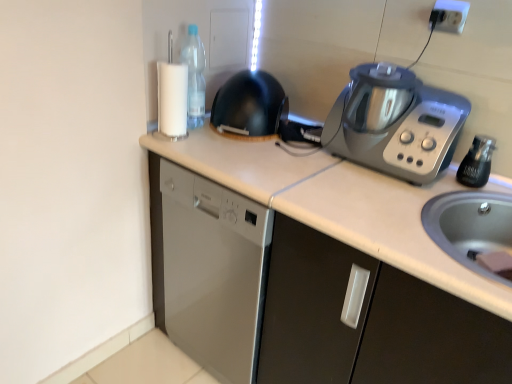
The image size is (512, 384). What do you see at coordinates (449, 16) in the screenshot?
I see `white plastic electric outlet at upper right` at bounding box center [449, 16].

Find the location of `black glass bottle at right, the 2th bottle when ordered from back to front`. black glass bottle at right, the 2th bottle when ordered from back to front is located at coordinates (477, 162).

Could you tell me if transparent plastic bottle at upper left, arranged as the second bottle when viewed from the front, is turned towards white plastic electric outlet at upper right?

No, transparent plastic bottle at upper left, arranged as the second bottle when viewed from the front, is not turned towards white plastic electric outlet at upper right.

From a real-world perspective, is transparent plastic bottle at upper left, which is the 1th bottle from top to bottom, physically below white plastic electric outlet at upper right?

Indeed, from a real-world perspective, transparent plastic bottle at upper left, which is the 1th bottle from top to bottom, is positioned beneath white plastic electric outlet at upper right.

Can you tell me how much transparent plastic bottle at upper left, which is the 1th bottle from top to bottom, and white plastic electric outlet at upper right differ in facing direction?

The angle between the facing direction of transparent plastic bottle at upper left, which is the 1th bottle from top to bottom, and the facing direction of white plastic electric outlet at upper right is 0.00301 degrees.

Between silver metallic kitchen appliance at upper right and transparent plastic bottle at upper left, which appears as the 1th bottle when viewed from the left, which one has smaller width?

With smaller width is transparent plastic bottle at upper left, which appears as the 1th bottle when viewed from the left.

From the picture: Is silver metallic kitchen appliance at upper right shorter than transparent plastic bottle at upper left, arranged as the second bottle when viewed from the front?

Correct, silver metallic kitchen appliance at upper right is not as tall as transparent plastic bottle at upper left, arranged as the second bottle when viewed from the front.

How many degrees apart are the facing directions of silver metallic kitchen appliance at upper right and transparent plastic bottle at upper left, arranged as the second bottle when viewed from the front?

silver metallic kitchen appliance at upper right and transparent plastic bottle at upper left, arranged as the second bottle when viewed from the front, are facing 0.000344 degrees away from each other.

Considering the relative sizes of black matte wok at center and black glass bottle at right, positioned as the 1th bottle in right-to-left order, in the image provided, is black matte wok at center shorter than black glass bottle at right, positioned as the 1th bottle in right-to-left order,?

Incorrect, the height of black matte wok at center does not fall short of that of black glass bottle at right, positioned as the 1th bottle in right-to-left order.

Looking at this image, which point is more forward, (270,132) or (492,138)?

The point (492,138) is more forward.

In terms of size, does black matte wok at center appear bigger or smaller than black glass bottle at right, which is the 1th bottle from bottom to top?

Considering their sizes, black matte wok at center takes up more space than black glass bottle at right, which is the 1th bottle from bottom to top.

From the image's perspective, is black matte wok at center located beneath black glass bottle at right, placed as the 2th bottle when sorted from top to bottom?

Actually, black matte wok at center appears above black glass bottle at right, placed as the 2th bottle when sorted from top to bottom, in the image.

Is silver metallic kitchen appliance at upper right located outside white matte countertop at center?

silver metallic kitchen appliance at upper right lies outside white matte countertop at center's area.

You are a GUI agent. You are given a task and a screenshot of the screen. Output one action in this format:
    pyautogui.click(x=<x>, y=<y>)
    Task: Click on the home appliance located above the white matte countertop at center (from the image's perspective)
    
    Given the screenshot: What is the action you would take?
    pyautogui.click(x=395, y=123)

Which object is further away from the camera, silver metallic kitchen appliance at upper right or white matte countertop at center?

silver metallic kitchen appliance at upper right is behind.

Which is nearer, (399, 126) or (383, 179)?

Point (399, 126)

Does black glass bottle at right, which is counted as the 2th bottle, starting from the left, come behind silver metallic kitchen appliance at upper right?

Yes, black glass bottle at right, which is counted as the 2th bottle, starting from the left, is further from the camera.

Considering the sizes of objects black glass bottle at right, positioned as the 1th bottle in right-to-left order, and silver metallic kitchen appliance at upper right in the image provided, who is taller, black glass bottle at right, positioned as the 1th bottle in right-to-left order, or silver metallic kitchen appliance at upper right?

silver metallic kitchen appliance at upper right.

Can you confirm if black glass bottle at right, placed as the 2th bottle when sorted from top to bottom, is wider than silver metallic kitchen appliance at upper right?

Incorrect, the width of black glass bottle at right, placed as the 2th bottle when sorted from top to bottom, does not surpass that of silver metallic kitchen appliance at upper right.

From a real-world perspective, is black glass bottle at right, which is counted as the 2th bottle, starting from the left, on silver metallic kitchen appliance at upper right?

Incorrect, from a real-world perspective, black glass bottle at right, which is counted as the 2th bottle, starting from the left, is lower than silver metallic kitchen appliance at upper right.

Consider the image. Considering the sizes of white matte countertop at center and black glass bottle at right, the 2th bottle when ordered from back to front, in the image, is white matte countertop at center bigger or smaller than black glass bottle at right, the 2th bottle when ordered from back to front,?

Clearly, white matte countertop at center is larger in size than black glass bottle at right, the 2th bottle when ordered from back to front.

From the image's perspective, between white matte countertop at center and black glass bottle at right, positioned as the 1th bottle in right-to-left order, which one is located above?

black glass bottle at right, positioned as the 1th bottle in right-to-left order, from the image's perspective.

Can you see white matte countertop at center touching black glass bottle at right, the 2th bottle when ordered from back to front?

No, white matte countertop at center is not touching black glass bottle at right, the 2th bottle when ordered from back to front.

Where is `countertop on the left of black glass bottle at right, which is the 1th bottle from bottom to top`? The height and width of the screenshot is (384, 512). countertop on the left of black glass bottle at right, which is the 1th bottle from bottom to top is located at coordinates (313, 271).

Is black matte wok at center completely or partially outside of white matte countertop at center?

black matte wok at center lies outside white matte countertop at center's area.

From the image's perspective, does black matte wok at center appear lower than white matte countertop at center?

Incorrect, from the image's perspective, black matte wok at center is higher than white matte countertop at center.

Can you confirm if black matte wok at center is positioned to the right of white matte countertop at center?

No.

Which of these two, black matte wok at center or white matte countertop at center, stands taller?

white matte countertop at center is taller.

Find the location of a particular element. Image resolution: width=512 pixels, height=384 pixels. bottle that is the 1st one when counting downward from the white plastic electric outlet at upper right (from the image's perspective) is located at coordinates (194, 77).

You are a GUI agent. You are given a task and a screenshot of the screen. Output one action in this format:
    pyautogui.click(x=<x>, y=<y>)
    Task: Click on the home appliance below the transparent plastic bottle at upper left, which appears as the 1th bottle when viewed from the left (from a real-world perspective)
    This screenshot has width=512, height=384.
    Given the screenshot: What is the action you would take?
    pyautogui.click(x=395, y=123)

When comparing their distances from white matte countertop at center, does transparent plastic bottle at upper left, positioned as the 2th bottle in bottom-to-top order, or silver metallic kitchen appliance at upper right seem closer?

silver metallic kitchen appliance at upper right lies closer to white matte countertop at center than the other object.

Which object lies further to the anchor point white matte countertop at center, transparent plastic bottle at upper left, which appears as the 1th bottle when viewed from the left, or black glass bottle at right, positioned as the 1th bottle in right-to-left order?

black glass bottle at right, positioned as the 1th bottle in right-to-left order, is positioned further to the anchor white matte countertop at center.

Looking at the image, which one is located further to transparent plastic bottle at upper left, positioned as the 2th bottle in bottom-to-top order, white plastic electric outlet at upper right or black matte wok at center?

white plastic electric outlet at upper right.

Which object lies nearer to the anchor point transparent plastic bottle at upper left, the 1th bottle from the back, white matte countertop at center or black glass bottle at right, which is the first bottle from front to back?

The object closer to transparent plastic bottle at upper left, the 1th bottle from the back, is white matte countertop at center.

Based on their spatial positions, is white matte countertop at center or white plastic electric outlet at upper right further from black glass bottle at right, which is the first bottle from front to back?

Based on the image, white matte countertop at center appears to be further to black glass bottle at right, which is the first bottle from front to back.

Looking at this image, when comparing their distances from white matte countertop at center, does black matte wok at center or white plastic electric outlet at upper right seem closer?

Among the two, black matte wok at center is located nearer to white matte countertop at center.

From the image, which object appears to be nearer to white plastic electric outlet at upper right, white matte countertop at center or silver metallic kitchen appliance at upper right?

silver metallic kitchen appliance at upper right lies closer to white plastic electric outlet at upper right than the other object.

Based on the photo, looking at the image, which one is located closer to black matte wok at center, white matte countertop at center or silver metallic kitchen appliance at upper right?

The object closer to black matte wok at center is silver metallic kitchen appliance at upper right.

I want to click on countertop located between black matte wok at center and black glass bottle at right, the 2th bottle when ordered from back to front, in the left-right direction, so click(313, 271).

Find the location of a particular element. electric outlet between transparent plastic bottle at upper left, which appears as the 1th bottle when viewed from the left, and black glass bottle at right, which is the first bottle from front to back, from left to right is located at coordinates (449, 16).

Where is `kitchen appliance situated between transparent plastic bottle at upper left, arranged as the second bottle when viewed from the front, and white plastic electric outlet at upper right from left to right`? This screenshot has width=512, height=384. kitchen appliance situated between transparent plastic bottle at upper left, arranged as the second bottle when viewed from the front, and white plastic electric outlet at upper right from left to right is located at coordinates (250, 107).

This screenshot has height=384, width=512. What are the coordinates of `home appliance that lies between black matte wok at center and white matte countertop at center from top to bottom` in the screenshot? It's located at (395, 123).